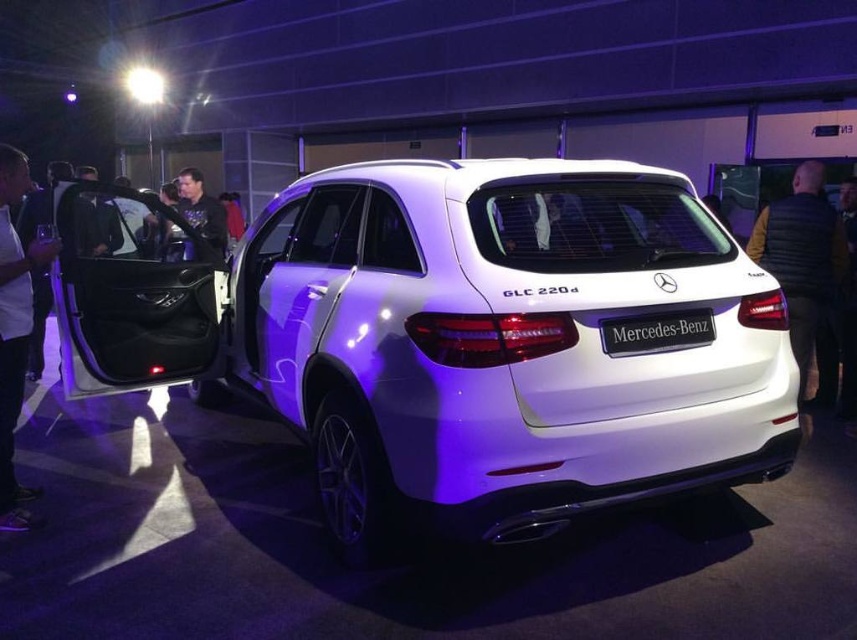
Question: Does white glossy suv at center appear under dark blue shirt at center?

Choices:
 (A) yes
 (B) no

Answer: (A)

Question: Which point is closer to the camera?

Choices:
 (A) (213, 200)
 (B) (321, 208)
 (C) (796, 278)

Answer: (B)

Question: Does black quilted vest at rear lie behind white shirt at left?

Choices:
 (A) no
 (B) yes

Answer: (B)

Question: Which of the following is the closest to the observer?

Choices:
 (A) black quilted vest at rear
 (B) white shirt at left

Answer: (B)

Question: Which of the following is the closest to the observer?

Choices:
 (A) (3, 525)
 (B) (820, 300)
 (C) (619, 374)
 (D) (190, 202)

Answer: (C)

Question: Does white shirt at left have a smaller size compared to black plastic mercedes-benz at center?

Choices:
 (A) no
 (B) yes

Answer: (A)